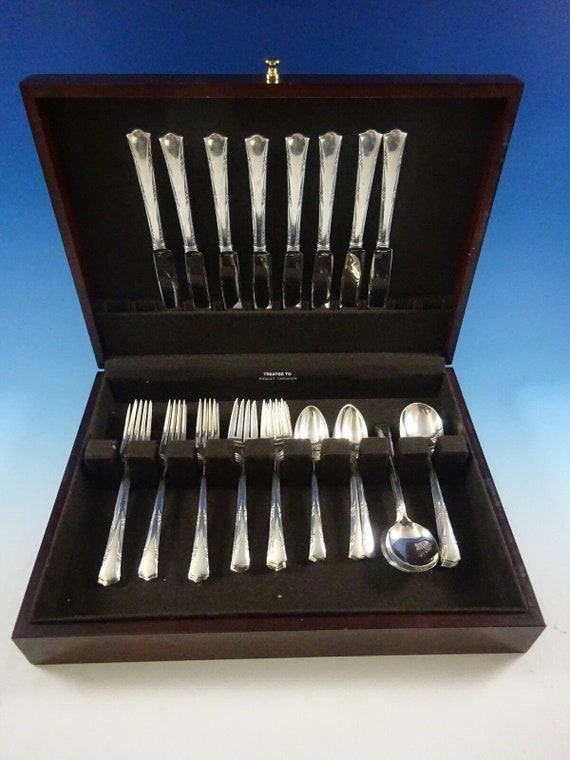
Locate an element on the screen. The width and height of the screenshot is (570, 760). knives is located at coordinates (154, 228), (217, 217), (188, 217), (252, 216), (292, 213), (321, 217), (357, 214), (389, 214).